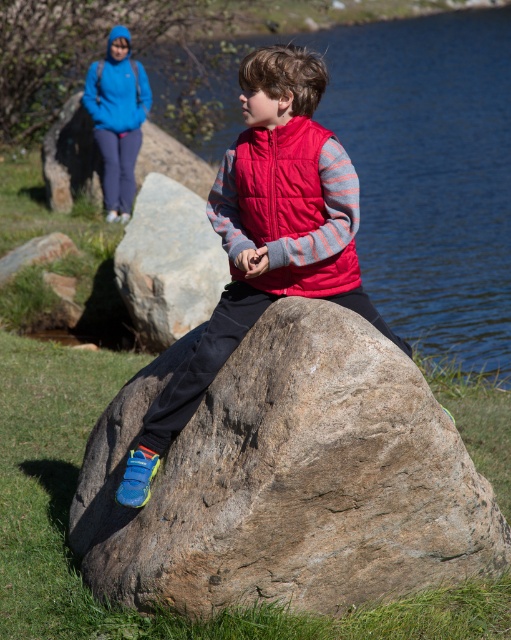
This screenshot has width=511, height=640. Identify the location of red puffy vest at center. (267, 236).

At what (x,y) coordinates should I click in order to perform the action: click on red puffy vest at center. Please return your answer as a coordinate pair (x, y). This screenshot has height=640, width=511. Looking at the image, I should click on (267, 236).

Is red puffy vest at center positioned behind matte red vest at center?

No, it is in front of matte red vest at center.

Is point (357, 202) less distant than point (332, 275)?

Yes, point (357, 202) is in front of point (332, 275).

Image resolution: width=511 pixels, height=640 pixels. What are the coordinates of `red puffy vest at center` in the screenshot? It's located at (267, 236).

Which is in front, point (180, 218) or point (117, 92)?

Point (180, 218) is in front.

Measure the distance between point [144,225] and camera.

14.05 meters

This screenshot has width=511, height=640. I want to click on gray rough boulder at center, so click(169, 262).